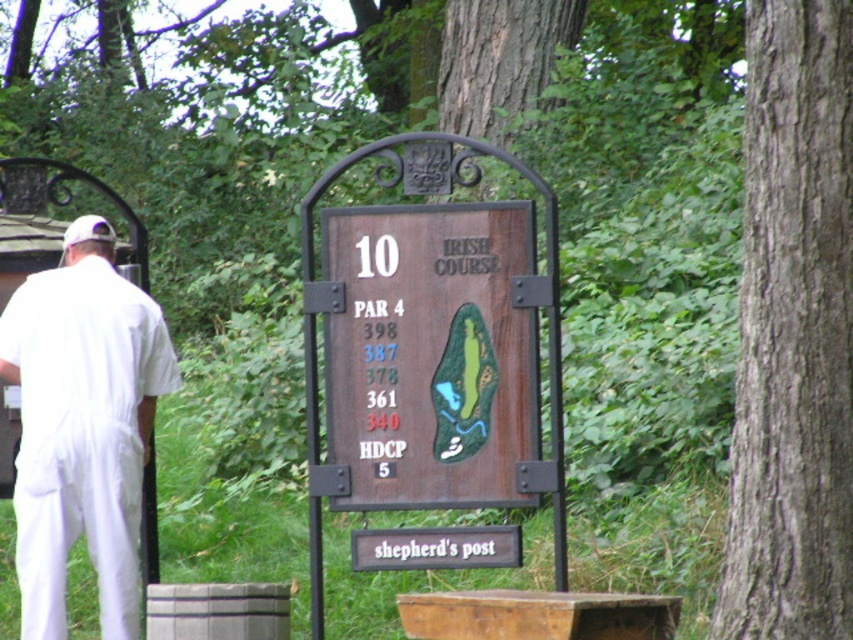
Who is more forward, (16, 465) or (67, 236)?

Point (16, 465) is more forward.

Does point (155, 387) come behind point (112, 237)?

No, (155, 387) is closer to viewer.

Where is `white cotton shirt at left`? This screenshot has height=640, width=853. white cotton shirt at left is located at coordinates (82, 432).

Does point (492, 378) lie behind point (83, 224)?

No, it is not.

Can you confirm if wooden sign at center is shorter than white fabric baseball cap at upper left?

Incorrect, wooden sign at center's height does not fall short of white fabric baseball cap at upper left's.

At what (x,y) coordinates should I click in order to perform the action: click on wooden sign at center. Please return your answer as a coordinate pair (x, y). The image size is (853, 640). Looking at the image, I should click on (430, 355).

Which is behind, point (453, 376) or point (56, 596)?

Positioned behind is point (56, 596).

Does wooden sign at center have a smaller size compared to white cotton shirt at left?

Yes.

Identify the location of wooden sign at center. This screenshot has height=640, width=853. (430, 355).

Where is `wooden sign at center`? The height and width of the screenshot is (640, 853). wooden sign at center is located at coordinates (430, 355).